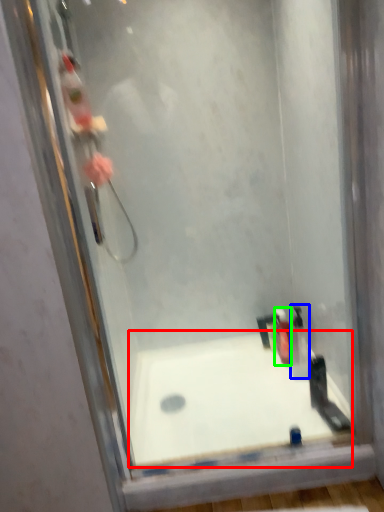
Question: Estimate the real-world distances between objects in this image. Which object is farther from bathtub (highlighted by a red box), toiletry (highlighted by a blue box) or toiletry (highlighted by a green box)?

Choices:
 (A) toiletry
 (B) toiletry

Answer: (B)